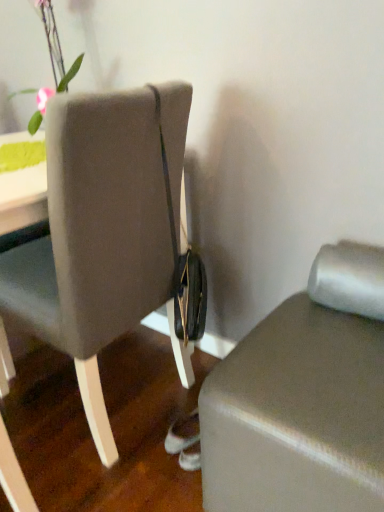
Question: Is matte gray ottoman at lower right next to green matte vase at upper left and touching it?

Choices:
 (A) no
 (B) yes

Answer: (A)

Question: From the image's perspective, is matte gray ottoman at lower right beneath green matte vase at upper left?

Choices:
 (A) no
 (B) yes

Answer: (B)

Question: From a real-world perspective, does matte gray ottoman at lower right sit lower than green matte vase at upper left?

Choices:
 (A) yes
 (B) no

Answer: (A)

Question: Is matte gray ottoman at lower right turned away from green matte vase at upper left?

Choices:
 (A) yes
 (B) no

Answer: (B)

Question: Is matte gray ottoman at lower right far from green matte vase at upper left?

Choices:
 (A) yes
 (B) no

Answer: (A)

Question: Considering the relative sizes of matte gray ottoman at lower right and green matte vase at upper left in the image provided, is matte gray ottoman at lower right taller than green matte vase at upper left?

Choices:
 (A) yes
 (B) no

Answer: (B)

Question: Is the depth of green matte vase at upper left greater than that of matte gray ottoman at lower right?

Choices:
 (A) yes
 (B) no

Answer: (A)

Question: Is green matte vase at upper left next to matte gray ottoman at lower right and touching it?

Choices:
 (A) yes
 (B) no

Answer: (B)

Question: Is green matte vase at upper left at the right side of matte gray ottoman at lower right?

Choices:
 (A) yes
 (B) no

Answer: (B)

Question: Is green matte vase at upper left far away from matte gray ottoman at lower right?

Choices:
 (A) yes
 (B) no

Answer: (A)

Question: Considering the relative sizes of green matte vase at upper left and matte gray ottoman at lower right in the image provided, is green matte vase at upper left wider than matte gray ottoman at lower right?

Choices:
 (A) no
 (B) yes

Answer: (A)

Question: Considering the relative sizes of green matte vase at upper left and matte gray ottoman at lower right in the image provided, is green matte vase at upper left bigger than matte gray ottoman at lower right?

Choices:
 (A) no
 (B) yes

Answer: (A)

Question: Is the surface of matte gray ottoman at lower right in direct contact with matte gray chair at center?

Choices:
 (A) no
 (B) yes

Answer: (A)